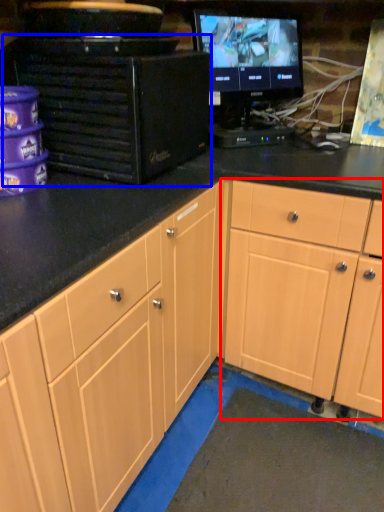
Question: Which object is closer to the camera taking this photo, cabinetry (highlighted by a red box) or desktop computer (highlighted by a blue box)?

Choices:
 (A) cabinetry
 (B) desktop computer

Answer: (B)